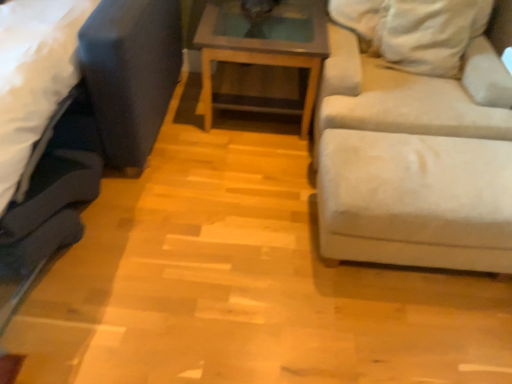
Question: Considering the relative positions of wooden glass top table at center and beige fabric couch at right, positioned as the first studio couch in right-to-left order, in the image provided, is wooden glass top table at center to the left of beige fabric couch at right, positioned as the first studio couch in right-to-left order, from the viewer's perspective?

Choices:
 (A) no
 (B) yes

Answer: (B)

Question: Considering the relative sizes of wooden glass top table at center and beige fabric couch at right, which is counted as the 2th studio couch, starting from the left, in the image provided, is wooden glass top table at center smaller than beige fabric couch at right, which is counted as the 2th studio couch, starting from the left,?

Choices:
 (A) yes
 (B) no

Answer: (A)

Question: From the image's perspective, does wooden glass top table at center appear lower than beige fabric couch at right, which is counted as the 2th studio couch, starting from the left?

Choices:
 (A) no
 (B) yes

Answer: (A)

Question: Can you confirm if wooden glass top table at center is positioned to the right of beige fabric couch at right, positioned as the first studio couch in right-to-left order?

Choices:
 (A) yes
 (B) no

Answer: (B)

Question: Could you tell me if wooden glass top table at center is turned towards beige fabric couch at right, which is counted as the 2th studio couch, starting from the left?

Choices:
 (A) yes
 (B) no

Answer: (B)

Question: Is wooden glass top table at center bigger or smaller than beige fabric couch at right, positioned as the first studio couch in right-to-left order?

Choices:
 (A) small
 (B) big

Answer: (A)

Question: From the image's perspective, is wooden glass top table at center positioned above or below beige fabric couch at right, positioned as the first studio couch in right-to-left order?

Choices:
 (A) below
 (B) above

Answer: (B)

Question: In terms of height, does wooden glass top table at center look taller or shorter compared to beige fabric couch at right, positioned as the first studio couch in right-to-left order?

Choices:
 (A) short
 (B) tall

Answer: (A)

Question: Relative to beige fabric couch at right, positioned as the first studio couch in right-to-left order, is wooden glass top table at center in front or behind?

Choices:
 (A) behind
 (B) front

Answer: (A)

Question: Is beige fabric couch at right, which is counted as the 2th studio couch, starting from the left, taller or shorter than velvet dark blue studio couch at left, acting as the first studio couch starting from the left?

Choices:
 (A) short
 (B) tall

Answer: (B)

Question: From the image's perspective, is beige fabric couch at right, which is counted as the 2th studio couch, starting from the left, located above or below velvet dark blue studio couch at left, acting as the first studio couch starting from the left?

Choices:
 (A) above
 (B) below

Answer: (A)

Question: In the image, is beige fabric couch at right, positioned as the first studio couch in right-to-left order, positioned in front of or behind velvet dark blue studio couch at left, acting as the first studio couch starting from the left?

Choices:
 (A) behind
 (B) front

Answer: (A)

Question: From a real-world perspective, is beige fabric couch at right, which is counted as the 2th studio couch, starting from the left, physically located above or below velvet dark blue studio couch at left, the 2th studio couch positioned from the right?

Choices:
 (A) above
 (B) below

Answer: (A)

Question: From a real-world perspective, is beige fabric couch at right, which is counted as the 2th studio couch, starting from the left, physically located above or below wooden glass top table at center?

Choices:
 (A) below
 (B) above

Answer: (B)

Question: Is beige fabric couch at right, which is counted as the 2th studio couch, starting from the left, taller or shorter than wooden glass top table at center?

Choices:
 (A) short
 (B) tall

Answer: (B)